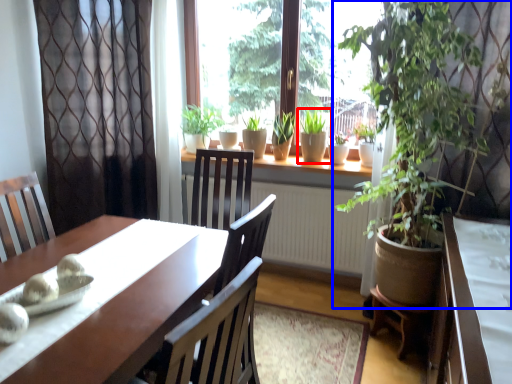
Question: Which object is further to the camera taking this photo, houseplant (highlighted by a red box) or houseplant (highlighted by a blue box)?

Choices:
 (A) houseplant
 (B) houseplant

Answer: (A)